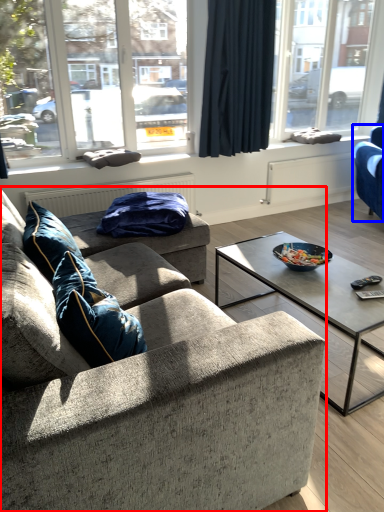
Question: Which object is further to the camera taking this photo, studio couch (highlighted by a red box) or studio couch (highlighted by a blue box)?

Choices:
 (A) studio couch
 (B) studio couch

Answer: (B)